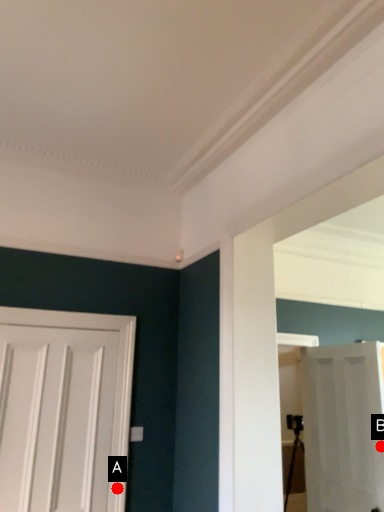
Question: Two points are circled on the image, labeled by A and B beside each circle. Which point is closer to the camera?

Choices:
 (A) A is closer
 (B) B is closer

Answer: (A)